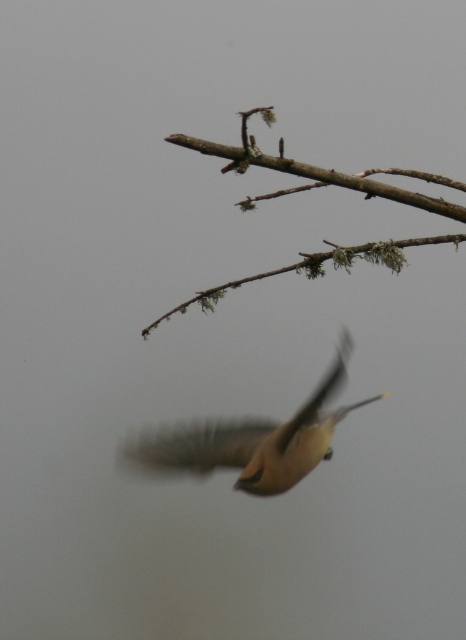
Question: Which point appears closest to the camera in this image?

Choices:
 (A) (436, 209)
 (B) (152, 460)

Answer: (A)

Question: Does brown feathered bird at center come behind brown mossy branch at upper center?

Choices:
 (A) no
 (B) yes

Answer: (B)

Question: Which point is closer to the camera taking this photo?

Choices:
 (A) (321, 394)
 (B) (365, 182)

Answer: (B)

Question: Where is brown feathered bird at center located in relation to brown mossy branch at upper center in the image?

Choices:
 (A) left
 (B) right

Answer: (A)

Question: Which point is closer to the camera taking this photo?

Choices:
 (A) (299, 451)
 (B) (357, 253)

Answer: (B)

Question: Can you confirm if brown feathered bird at center is positioned to the left of brown mossy branch at upper center?

Choices:
 (A) yes
 (B) no

Answer: (A)